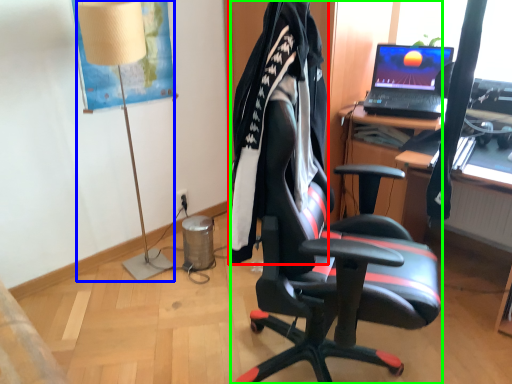
Question: Which object is positioned farthest from clothing (highlighted by a red box)? Select from lamp (highlighted by a blue box) and chair (highlighted by a green box).

Choices:
 (A) lamp
 (B) chair

Answer: (A)